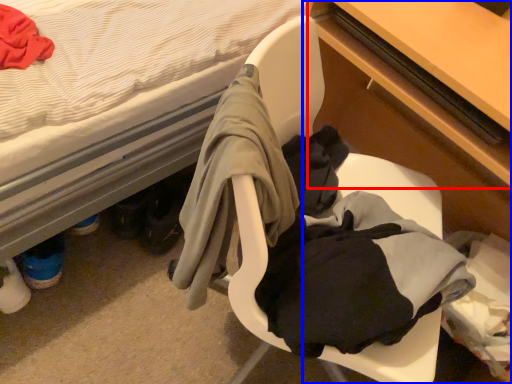
Question: Which point is closer to the camera, table (highlighted by a red box) or desk (highlighted by a blue box)?

Choices:
 (A) table
 (B) desk

Answer: (B)